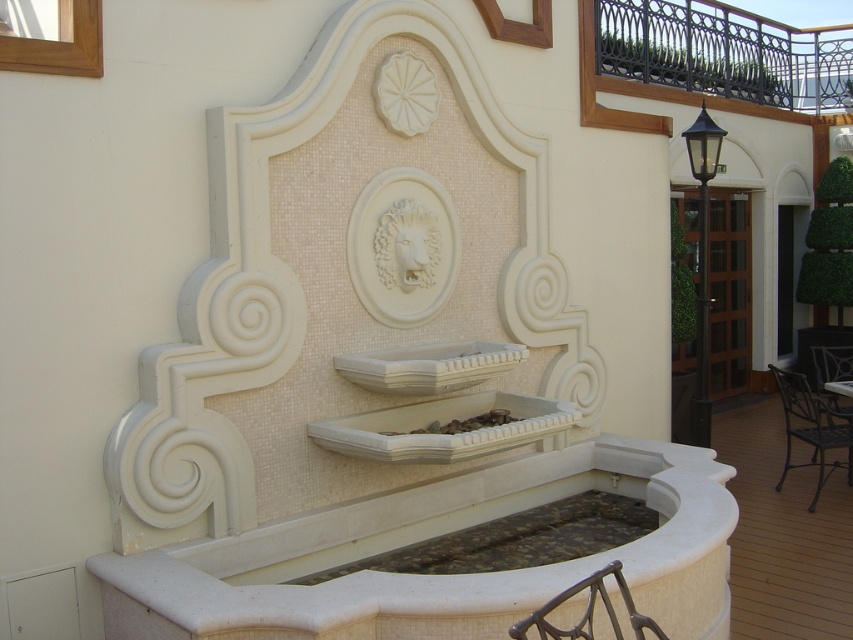
Question: In this image, where is metallic dark brown chair at right located relative to metallic wrought iron chair at lower center?

Choices:
 (A) left
 (B) right

Answer: (B)

Question: Which point is farther to the camera?

Choices:
 (A) (821, 440)
 (B) (842, 368)

Answer: (B)

Question: Which object appears farthest from the camera in this image?

Choices:
 (A) metallic wrought iron chair at lower center
 (B) metallic dark gray chair at right
 (C) metallic dark brown chair at right

Answer: (B)

Question: Does metallic dark brown chair at right come behind metallic wrought iron chair at lower center?

Choices:
 (A) no
 (B) yes

Answer: (B)

Question: Based on their relative distances, which object is farther from the metallic dark brown chair at right?

Choices:
 (A) metallic dark gray chair at right
 (B) metallic wrought iron chair at lower center

Answer: (B)

Question: Does metallic wrought iron chair at lower center appear under metallic dark gray chair at right?

Choices:
 (A) no
 (B) yes

Answer: (B)